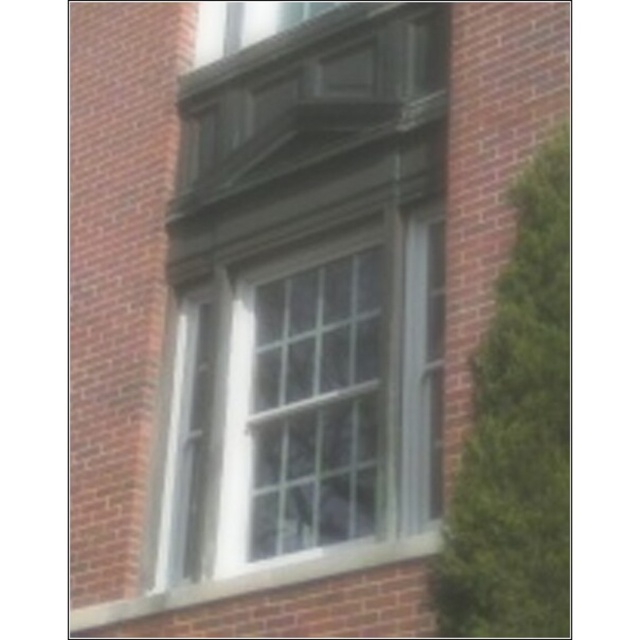
I want to click on white glass window at center, so click(x=307, y=403).

Which is below, white glass window at center or white painted wood at lower center?

white painted wood at lower center

Where is `white glass window at center`? white glass window at center is located at coordinates (307, 403).